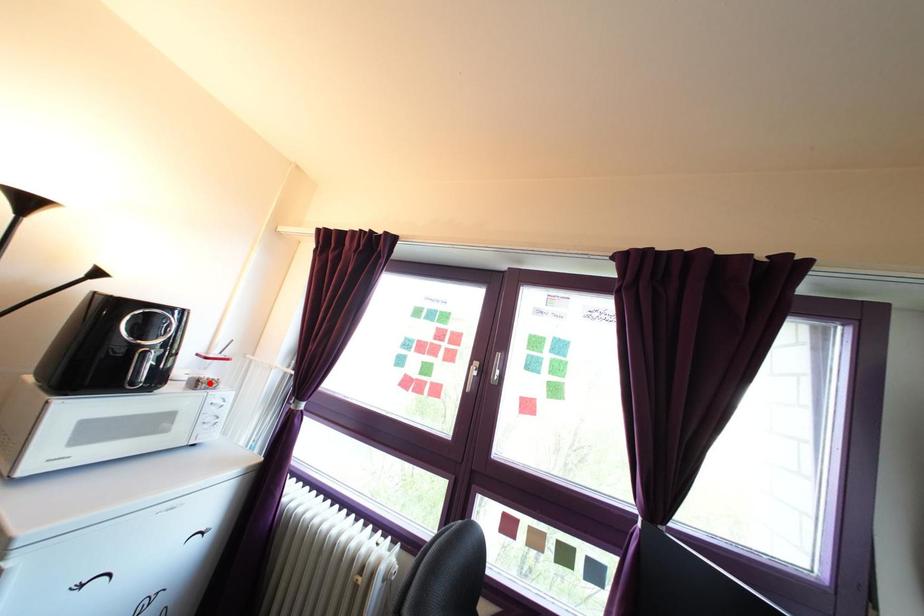
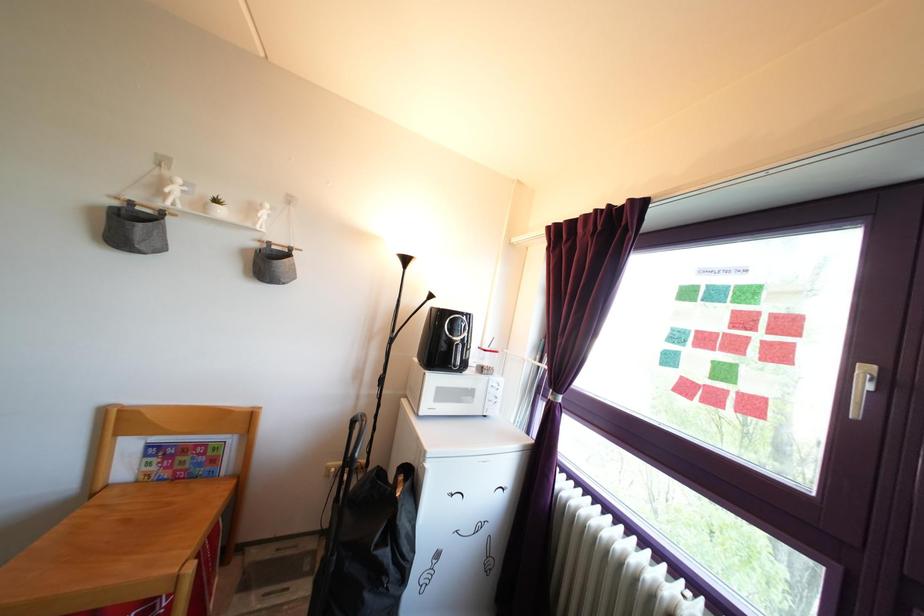
In the second image, find the point that corresponds to the highlighted location in the first image.

(489, 371)